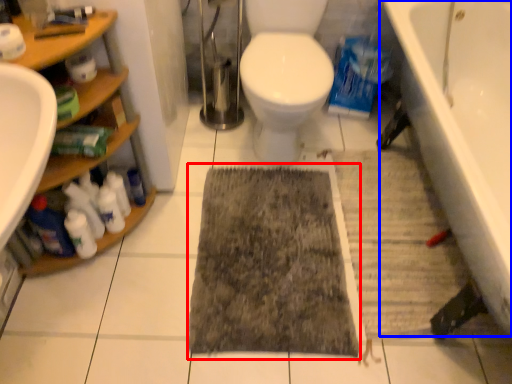
Question: Which of the following is the closest to the observer, doormat (highlighted by a red box) or bathtub (highlighted by a blue box)?

Choices:
 (A) doormat
 (B) bathtub

Answer: (B)